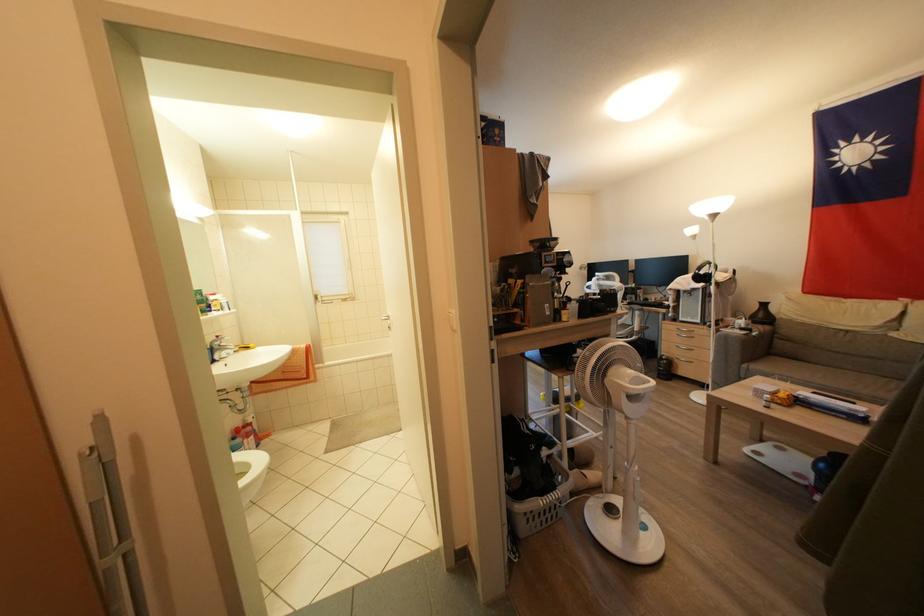
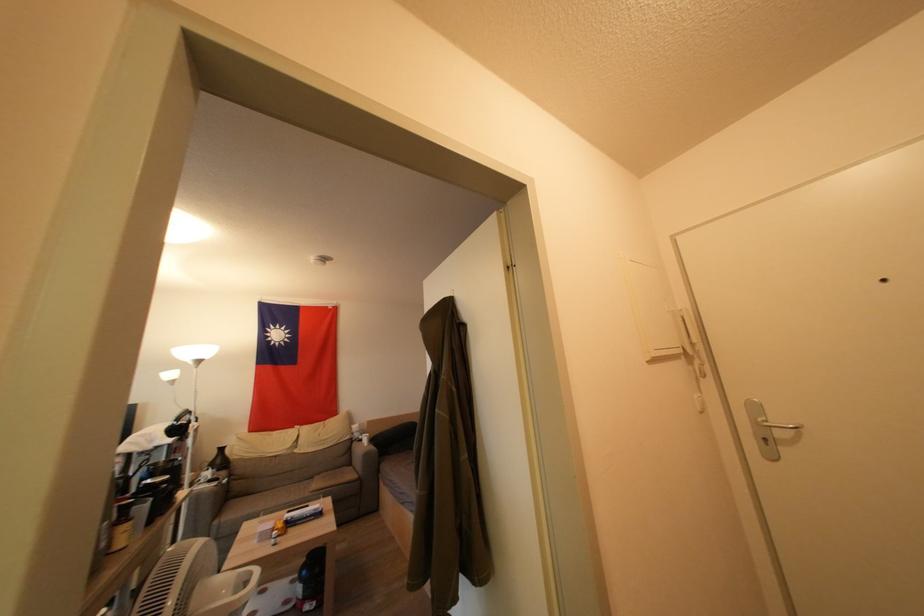
Locate, in the second image, the point that corresponds to (x=748, y=370) in the first image.

(221, 525)